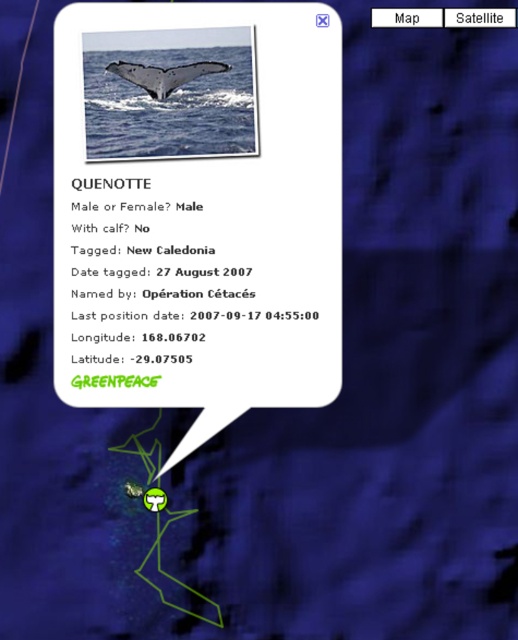
Between black paper text at upper center and blue water at tail right, which one is positioned lower?

black paper text at upper center

Which is behind, point (174, 314) or point (159, 141)?

Positioned behind is point (174, 314).

Between point (99, 200) and point (221, 109), which one is positioned in front?

Point (221, 109) is in front.

Where is `black paper text at upper center`? The image size is (518, 640). black paper text at upper center is located at coordinates (194, 262).

In the scene shown: Between blue water at tail right and gray matte whale tail at upper center, which one has less height?

Standing shorter between the two is gray matte whale tail at upper center.

Is point (179, 112) less distant than point (157, 86)?

No, (179, 112) is further to viewer.

What are the coordinates of `blue water at tail right` in the screenshot? It's located at (167, 97).

Measure the distance between black paper text at upper center and gray matte whale tail at upper center.

The distance of black paper text at upper center from gray matte whale tail at upper center is 5.78 inches.

Which of these two, black paper text at upper center or gray matte whale tail at upper center, stands taller?

With more height is black paper text at upper center.

Which is behind, point (328, 291) or point (151, 76)?

The point (328, 291) is more distant.

The height and width of the screenshot is (640, 518). I want to click on black paper text at upper center, so click(x=194, y=262).